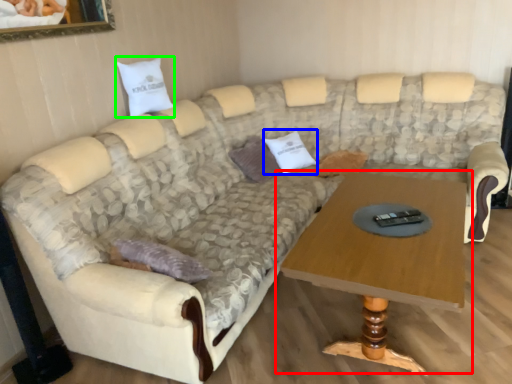
Question: Estimate the real-world distances between objects in this image. Which object is farther from coffee table (highlighted by a red box), pillow (highlighted by a blue box) or pillow (highlighted by a green box)?

Choices:
 (A) pillow
 (B) pillow

Answer: (B)